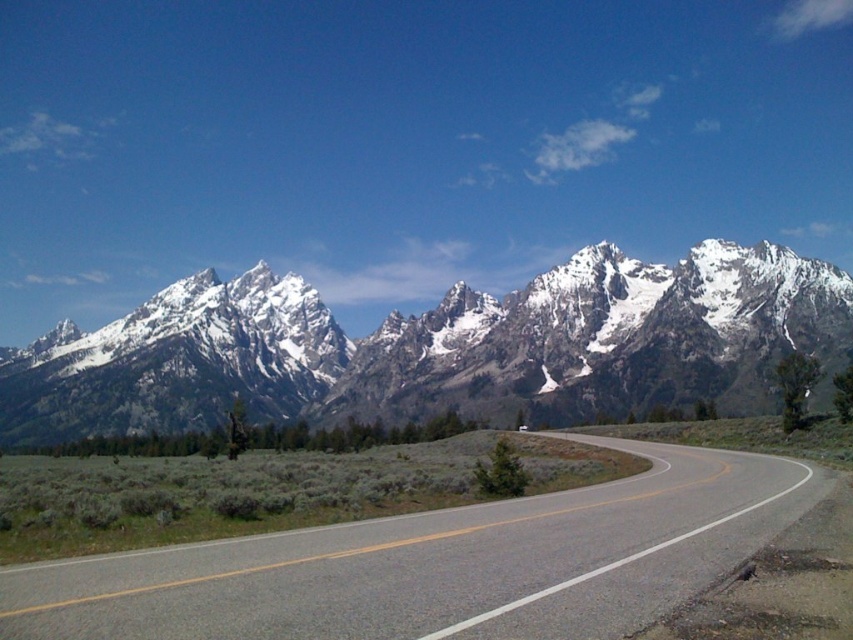
Is snowy granite mountain range at upper center further to the viewer compared to asphalt road at center?

Yes, it is behind asphalt road at center.

Does snowy granite mountain range at upper center have a greater width compared to asphalt road at center?

Yes.

Is point (447, 365) in front of point (7, 576)?

That is False.

At what (x,y) coordinates should I click in order to perform the action: click on snowy granite mountain range at upper center. Please return your answer as a coordinate pair (x, y). The width and height of the screenshot is (853, 640). Looking at the image, I should click on (439, 346).